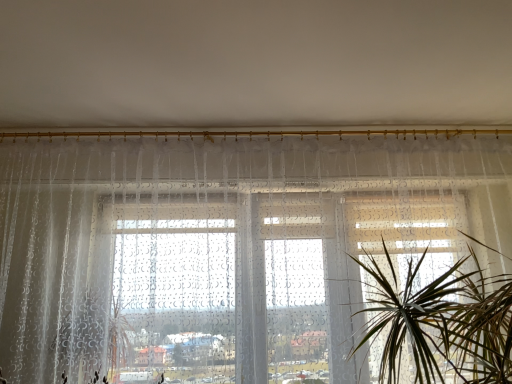
Question: In the image, is green leafy plant at center positioned in front of or behind transparent fabric window at center?

Choices:
 (A) behind
 (B) front

Answer: (B)

Question: Which is correct: green leafy plant at center is inside transparent fabric window at center, or outside of it?

Choices:
 (A) inside
 (B) outside

Answer: (B)

Question: Considering the positions of point (379, 309) and point (49, 372), is point (379, 309) closer or farther from the camera than point (49, 372)?

Choices:
 (A) farther
 (B) closer

Answer: (B)

Question: Is transparent fabric window at center situated inside green leafy plant at center or outside?

Choices:
 (A) inside
 (B) outside

Answer: (B)

Question: Based on their positions, is transparent fabric window at center located to the left or right of green leafy plant at center?

Choices:
 (A) right
 (B) left

Answer: (B)

Question: Looking at their shapes, would you say transparent fabric window at center is wider or thinner than green leafy plant at center?

Choices:
 (A) thin
 (B) wide

Answer: (A)

Question: Considering the positions of transparent fabric window at center and green leafy plant at center in the image, is transparent fabric window at center bigger or smaller than green leafy plant at center?

Choices:
 (A) big
 (B) small

Answer: (A)